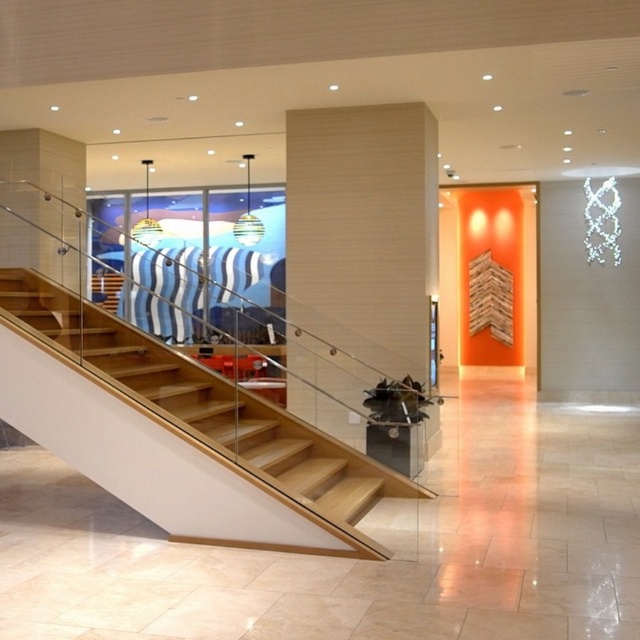
You are an interior designer planning to place a large sculpture in this space. The sculpture requires a clear area of at least 2 meters in diameter. Considering the wooden pillar at center and the wooden stairs at center, which object would you avoid placing the sculpture near due to its size?

The wooden pillar at center has a smaller size compared to wooden stairs at center, so you should avoid placing the sculpture near the wooden stairs at center because they take up more space and would interfere with the required clear area.

You are standing at the center of the modern interior space and want to locate the point at coordinates (364, 230). According to the scene description, where exactly would this point be located?

The point at coordinates (364, 230) is located on the wooden pillar at center.